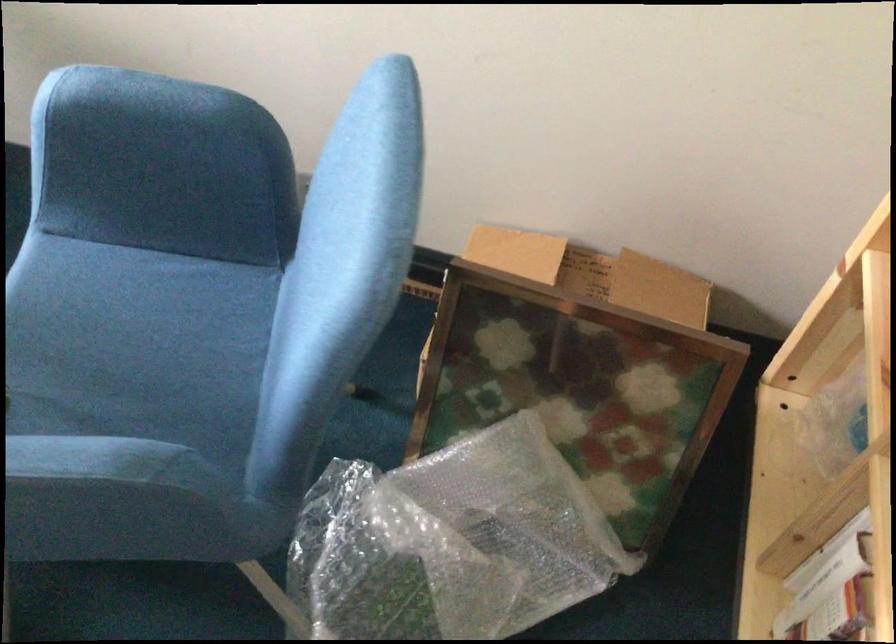
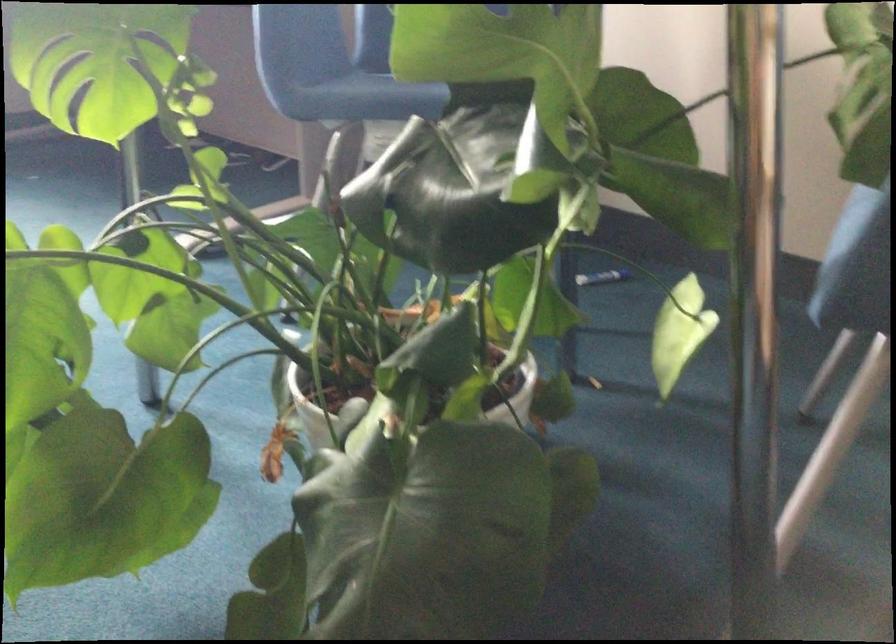
How did the camera likely rotate?

The camera rotated toward left-up.